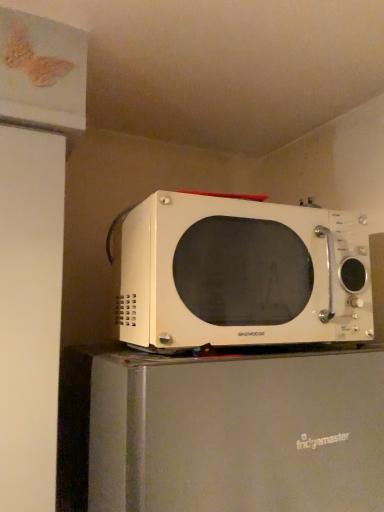
The image size is (384, 512). Describe the element at coordinates (241, 273) in the screenshot. I see `white matte microwave at upper center` at that location.

At what (x,y) coordinates should I click in order to perform the action: click on white matte microwave at upper center. Please return your answer as a coordinate pair (x, y). This screenshot has width=384, height=512. Looking at the image, I should click on (241, 273).

Locate an element on the screen. white matte microwave at upper center is located at coordinates (241, 273).